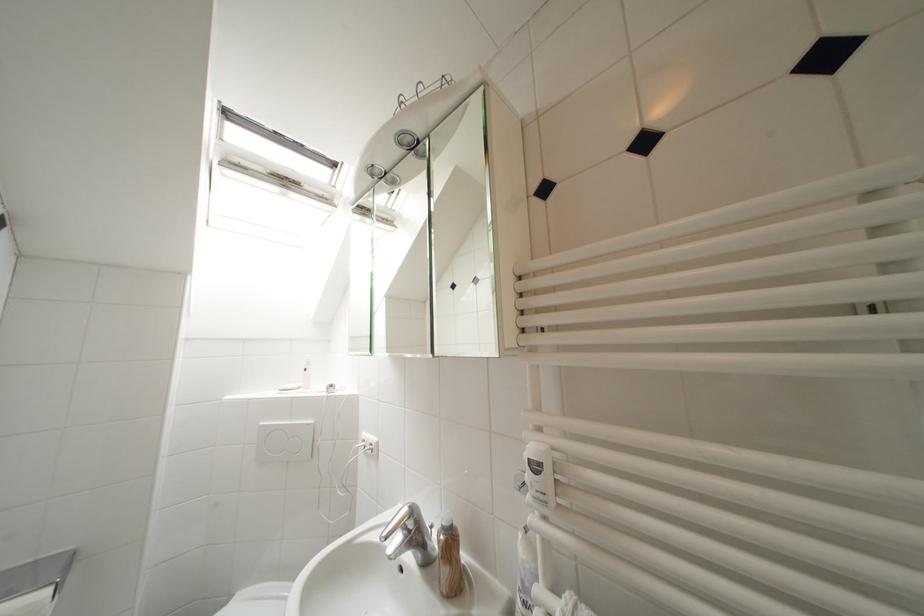
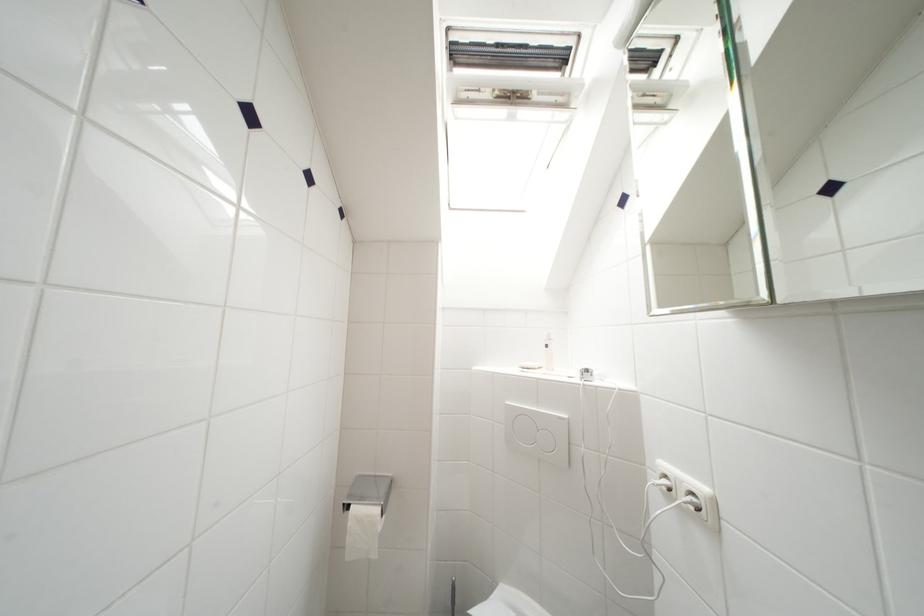
Question: Based on the continuous images, in which direction is the camera rotating? Reply with the corresponding letter.

Choices:
 (A) Left
 (B) Right
 (C) Up
 (D) Down

Answer: (A)